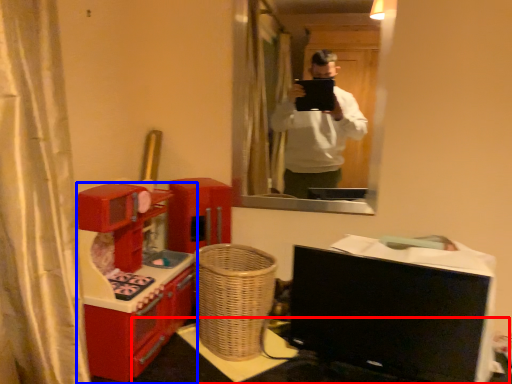
Question: Which of the following is the farthest to the observer, table (highlighted by a red box) or furniture (highlighted by a blue box)?

Choices:
 (A) table
 (B) furniture

Answer: (A)